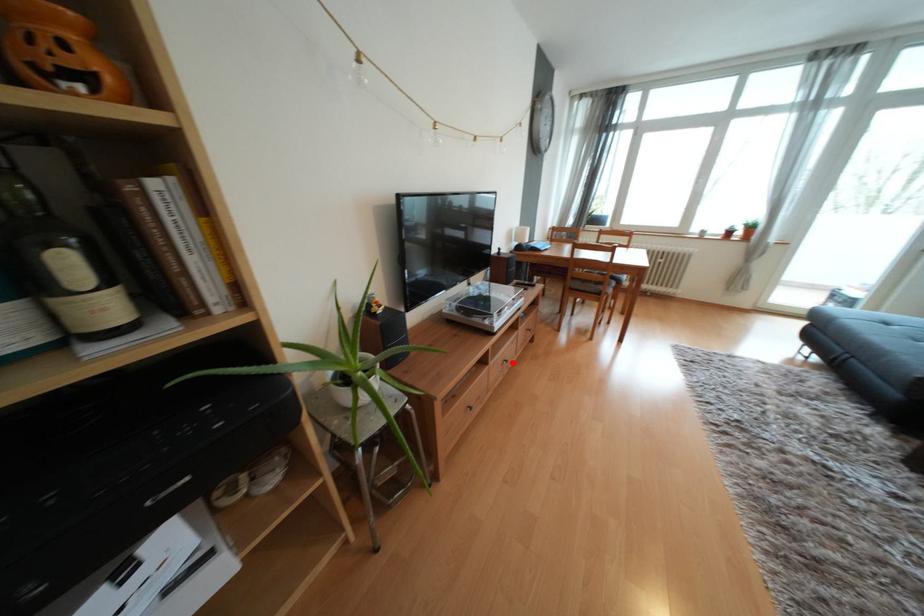
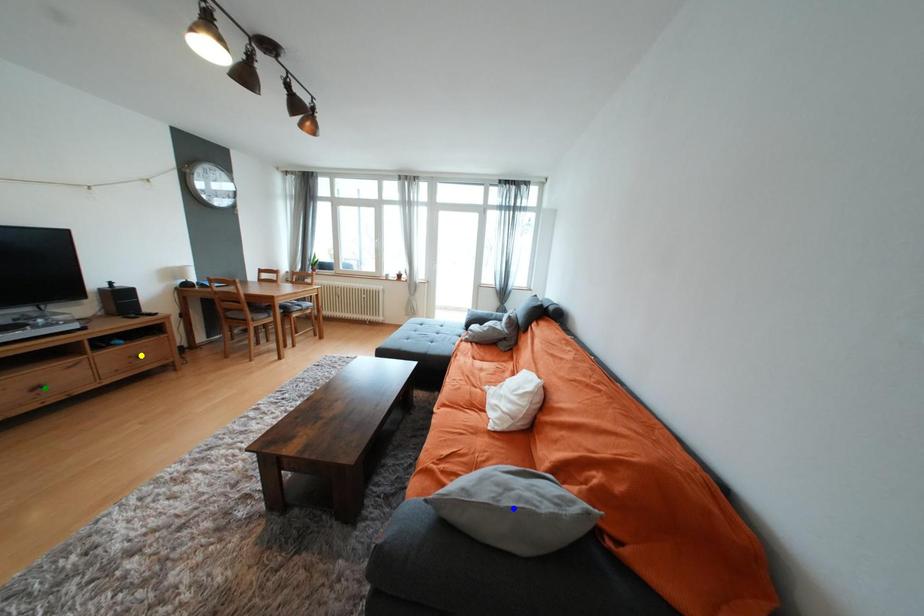
Question: I am providing you with two images of the same scene from different viewpoints. A red point is marked on the first image. You are given multiple points on the second image. In image 2, which mark is for the same physical point as the one in image 1?

Choices:
 (A) blue point
 (B) yellow point
 (C) green point

Answer: (C)